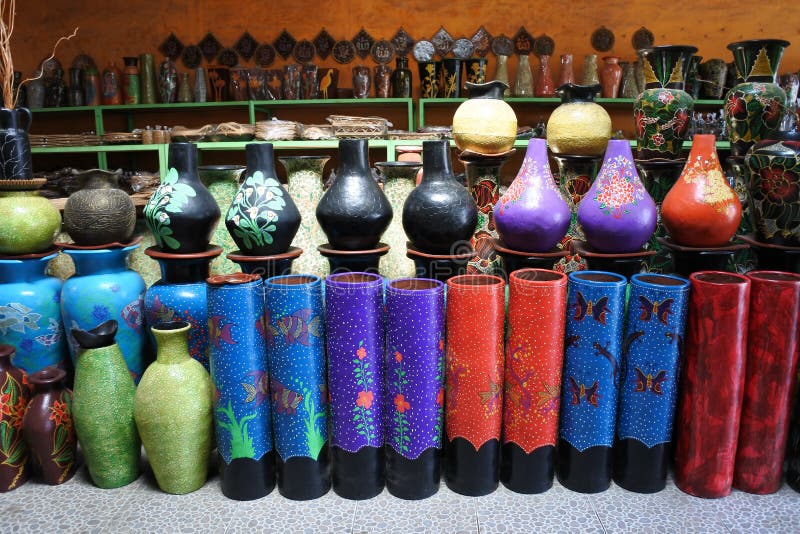
Locate an element on the screen. green vases is located at coordinates (117, 443), (198, 424).